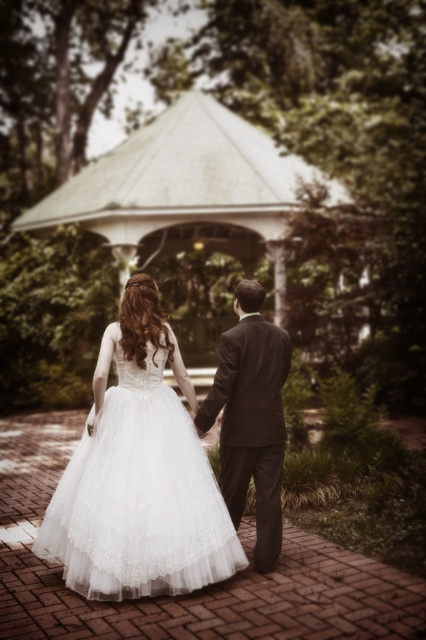
From the picture: Between white lace dress at center and dark brown suit at center, which one appears on the right side from the viewer's perspective?

Positioned to the right is dark brown suit at center.

Can you confirm if white lace dress at center is positioned to the right of dark brown suit at center?

In fact, white lace dress at center is to the left of dark brown suit at center.

The image size is (426, 640). Describe the element at coordinates (138, 496) in the screenshot. I see `white lace dress at center` at that location.

This screenshot has width=426, height=640. In order to click on white lace dress at center in this screenshot , I will do `click(138, 496)`.